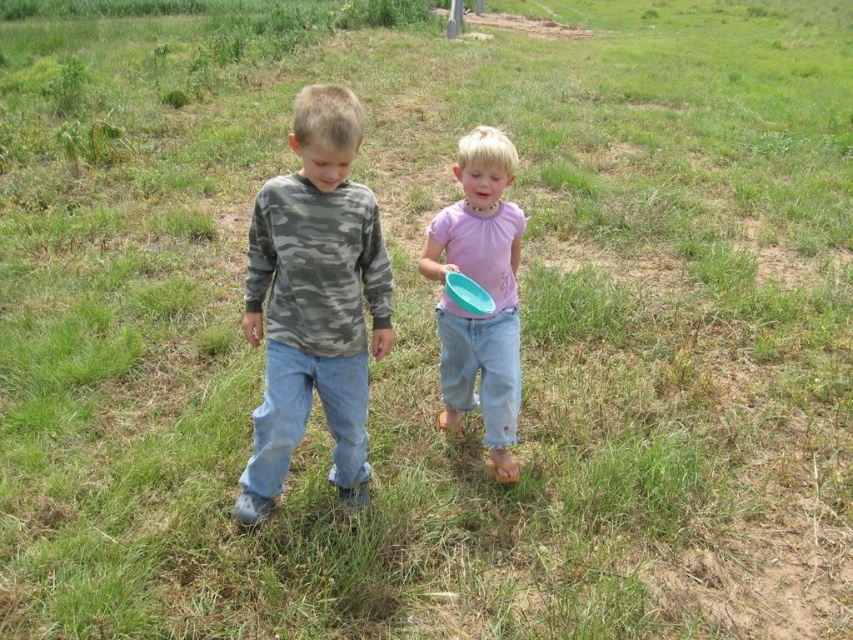
Measure the distance from camo fabric shirt at center to matte blue frisbee at center.

The distance of camo fabric shirt at center from matte blue frisbee at center is 15.73 inches.

Is camo fabric shirt at center taller than matte blue frisbee at center?

Yes, camo fabric shirt at center is taller than matte blue frisbee at center.

Between point (258, 429) and point (486, 310), which one is positioned in front?

Positioned in front is point (486, 310).

Where is `camo fabric shirt at center`? The width and height of the screenshot is (853, 640). camo fabric shirt at center is located at coordinates (314, 300).

This screenshot has height=640, width=853. In order to click on camo fabric shirt at center in this screenshot , I will do `click(314, 300)`.

Can you confirm if camo fabric shirt at center is positioned to the right of pink matte shirt at center?

In fact, camo fabric shirt at center is to the left of pink matte shirt at center.

Is point (347, 436) closer to camera compared to point (473, 196)?

Yes, point (347, 436) is in front of point (473, 196).

Find the location of `camo fabric shirt at center`. camo fabric shirt at center is located at coordinates (314, 300).

Does pink matte shirt at center have a larger size compared to matte blue frisbee at center?

Yes, pink matte shirt at center is bigger than matte blue frisbee at center.

Does pink matte shirt at center appear over matte blue frisbee at center?

No, pink matte shirt at center is not above matte blue frisbee at center.

Does point (485, 272) come farther from viewer compared to point (463, 305)?

Yes.

The image size is (853, 640). In order to click on pink matte shirt at center in this screenshot , I will do `click(485, 289)`.